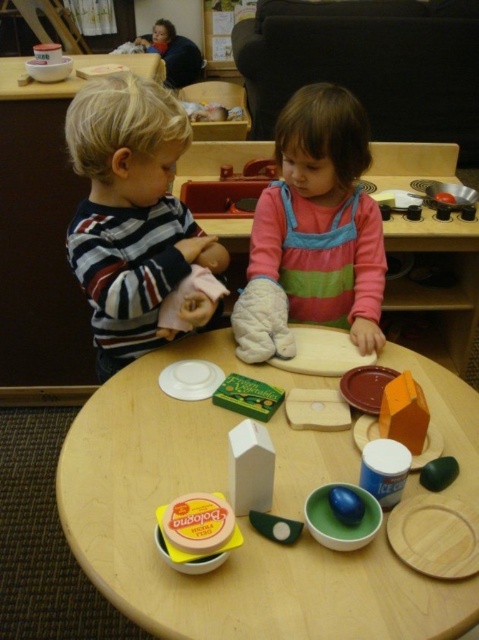
Question: Which point is farther to the camera?

Choices:
 (A) (x=171, y=96)
 (B) (x=319, y=273)
 (C) (x=127, y=515)

Answer: (B)

Question: Can you confirm if striped cotton shirt at left is positioned to the right of pink striped dress at center?

Choices:
 (A) yes
 (B) no

Answer: (B)

Question: Which object is positioned closest to the pink striped dress at center?

Choices:
 (A) wooden toy at center
 (B) striped cotton shirt at left

Answer: (B)

Question: Which point is farther to the camera?

Choices:
 (A) (76, 113)
 (B) (305, 140)
 (C) (436, 371)

Answer: (B)

Question: Can you confirm if wooden toy at center is bigger than striped cotton shirt at left?

Choices:
 (A) yes
 (B) no

Answer: (A)

Question: Does striped cotton shirt at left have a larger size compared to pink striped dress at center?

Choices:
 (A) yes
 (B) no

Answer: (A)